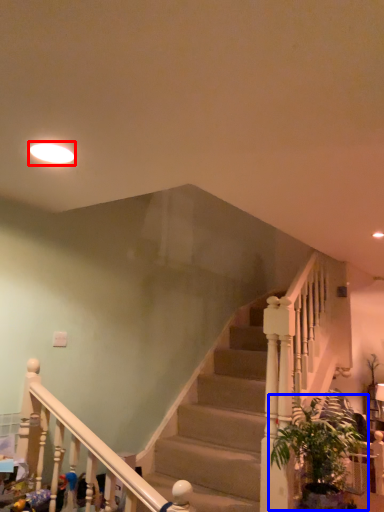
Question: Which point is closer to the camera, lighting (highlighted by a red box) or houseplant (highlighted by a blue box)?

Choices:
 (A) lighting
 (B) houseplant

Answer: (A)